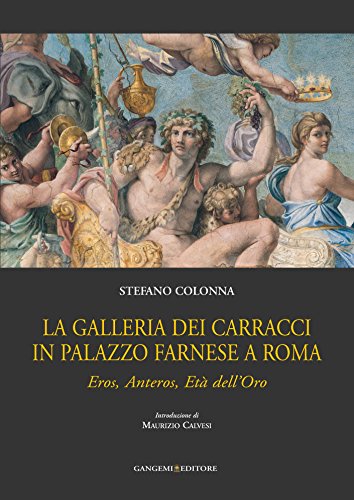
Identify the location of gold pitcher. (139, 92).